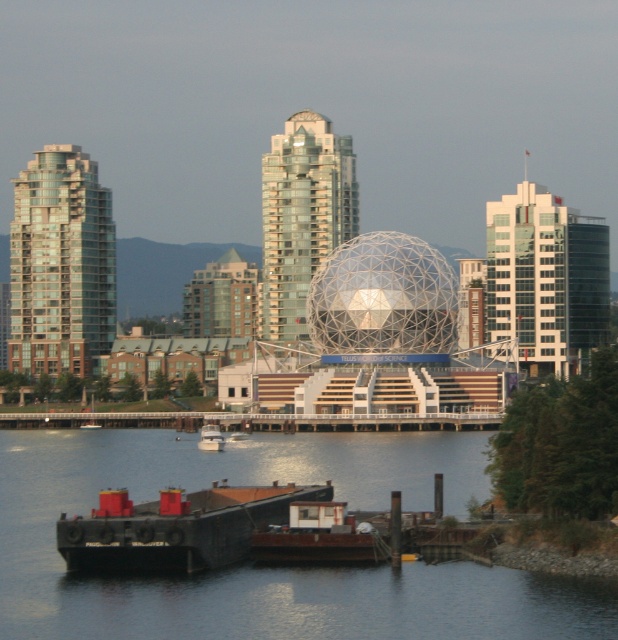
You are standing at the center of the image and want to reach the dark blue water at lower center. According to the coordinates provided, in which direction should you move to get there?

The dark blue water at lower center is located at point (268,566). Since the coordinates are based on a 1x1 grid where lower center corresponds to lower y values, you should move downward from the center to reach it.

You are standing on a pier and want to throw a small stone into the dark blue water at lower center. Considering the distance, do you think you can reach it with a single throw?

The dark blue water at lower center is 339.84 meters away from the viewer. Since the average human can throw a stone about 20 to 30 meters, you cannot reach it with a single throw.